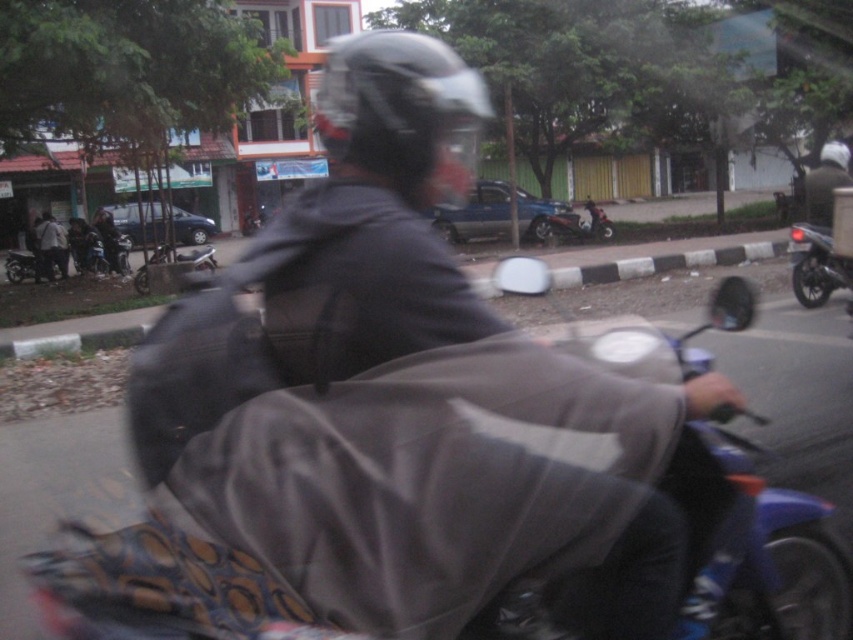
The image size is (853, 640). In order to click on blue plastic motorcycle at center in this screenshot , I will do `click(753, 547)`.

Image resolution: width=853 pixels, height=640 pixels. Describe the element at coordinates (753, 547) in the screenshot. I see `blue plastic motorcycle at center` at that location.

Locate an element on the screen. The width and height of the screenshot is (853, 640). blue plastic motorcycle at center is located at coordinates (753, 547).

Can you confirm if glossy black helmet at center is taller than blue glossy motorcycle at center?

Indeed, glossy black helmet at center has a greater height compared to blue glossy motorcycle at center.

Consider the image. Is glossy black helmet at center below blue glossy motorcycle at center?

No.

Where is `glossy black helmet at center`? glossy black helmet at center is located at coordinates (401, 115).

I want to click on glossy black helmet at center, so click(x=401, y=115).

From the picture: Can you confirm if glossy black helmet at center is positioned to the right of metallic silver scooter at center?

In fact, glossy black helmet at center is to the left of metallic silver scooter at center.

Between point (413, 38) and point (595, 214), which one is positioned in front?

Point (413, 38) is more forward.

The height and width of the screenshot is (640, 853). What are the coordinates of `glossy black helmet at center` in the screenshot? It's located at (401, 115).